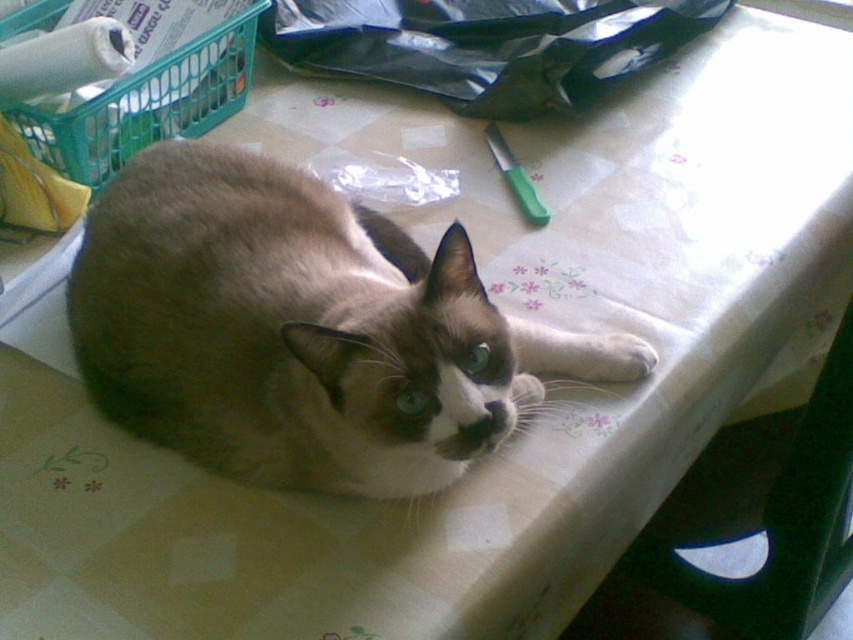
Can you confirm if silky fur cat at center is shorter than green plastic basket at upper left?

No.

Between silky fur cat at center and green plastic basket at upper left, which one appears on the left side from the viewer's perspective?

From the viewer's perspective, green plastic basket at upper left appears more on the left side.

Where is `silky fur cat at center`? This screenshot has height=640, width=853. silky fur cat at center is located at coordinates (300, 330).

The image size is (853, 640). What do you see at coordinates (746, 528) in the screenshot?
I see `green plastic chair at lower right` at bounding box center [746, 528].

This screenshot has width=853, height=640. Identify the location of green plastic chair at lower right. (746, 528).

Which is in front, point (164, 257) or point (846, 488)?

Point (164, 257) is more forward.

Which is more to the right, silky fur cat at center or green plastic chair at lower right?

green plastic chair at lower right

The width and height of the screenshot is (853, 640). Describe the element at coordinates (300, 330) in the screenshot. I see `silky fur cat at center` at that location.

This screenshot has height=640, width=853. Find the location of `silky fur cat at center`. silky fur cat at center is located at coordinates (300, 330).